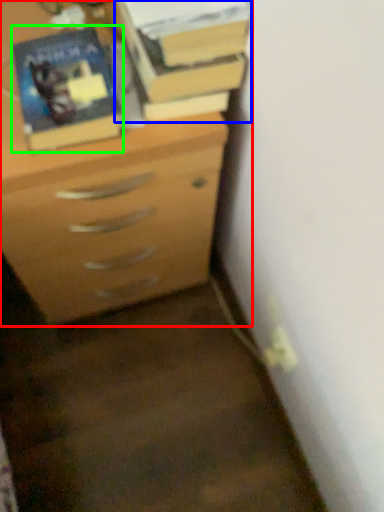
Question: Which object is positioned farthest from chest of drawers (highlighted by a red box)? Select from book (highlighted by a blue box) and paperback book (highlighted by a green box).

Choices:
 (A) book
 (B) paperback book

Answer: (A)